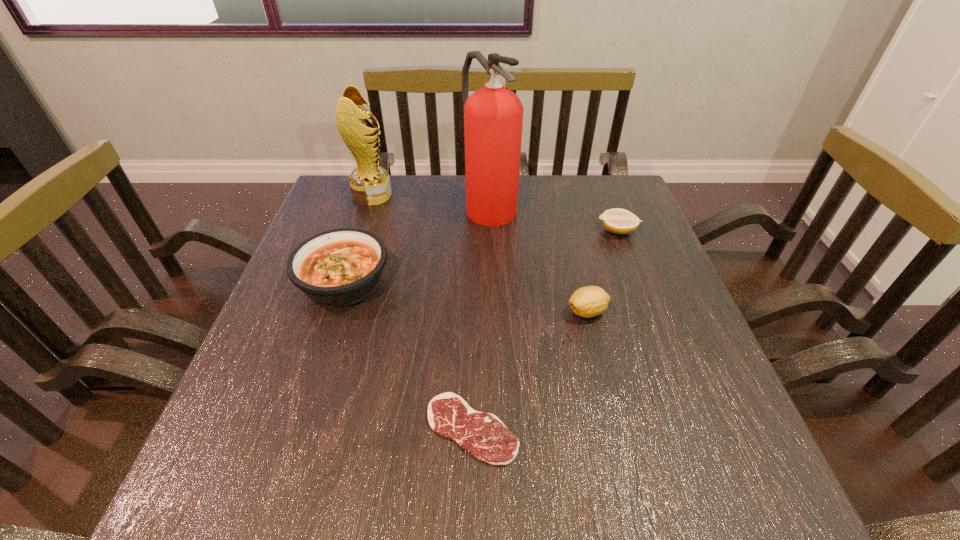
This screenshot has width=960, height=540. What are the coordinates of `vacant area situated 0.260m on the front-facing side of the award` in the screenshot? It's located at (482, 195).

Find the location of `free space located on the right of the stew`. free space located on the right of the stew is located at coordinates (484, 282).

Find the location of a particular element. Image resolution: width=960 pixels, height=540 pixels. free space located 0.400m at the stem end of the left lemon is located at coordinates (378, 312).

The width and height of the screenshot is (960, 540). In order to click on free space located 0.090m at the stem end of the left lemon in this screenshot , I will do `click(524, 312)`.

Identify the location of vacant space located at the stem end of the left lemon. This screenshot has height=540, width=960. (378, 312).

This screenshot has height=540, width=960. Identify the location of free space located 0.230m on the left of the second shortest object. (508, 231).

I want to click on free space located on the back of the steak, so click(x=473, y=327).

Locate an element on the screen. fire extinguisher located in the far edge section of the desktop is located at coordinates (493, 116).

Where is `award located at the far edge`? The width and height of the screenshot is (960, 540). award located at the far edge is located at coordinates (370, 185).

The height and width of the screenshot is (540, 960). I want to click on object located at the near edge, so tap(483, 435).